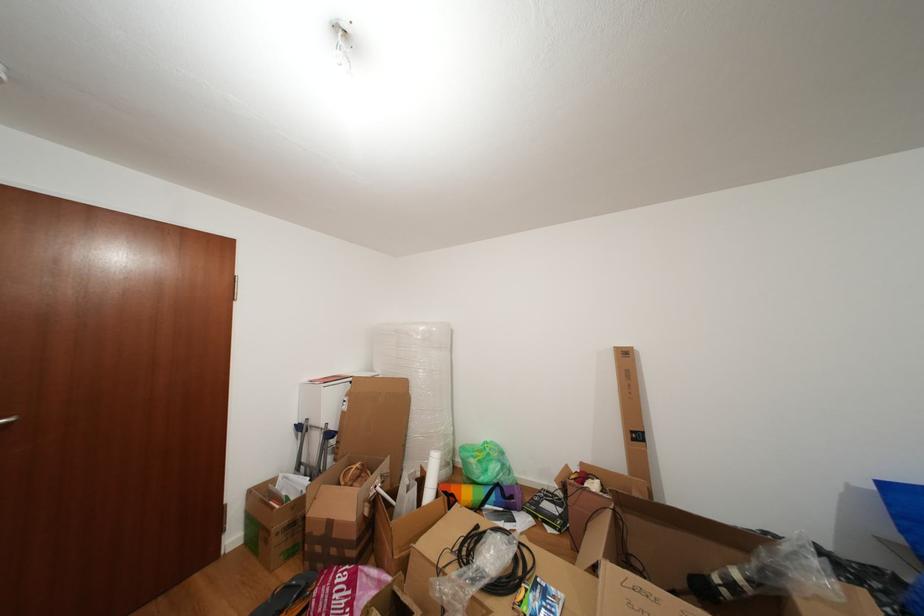
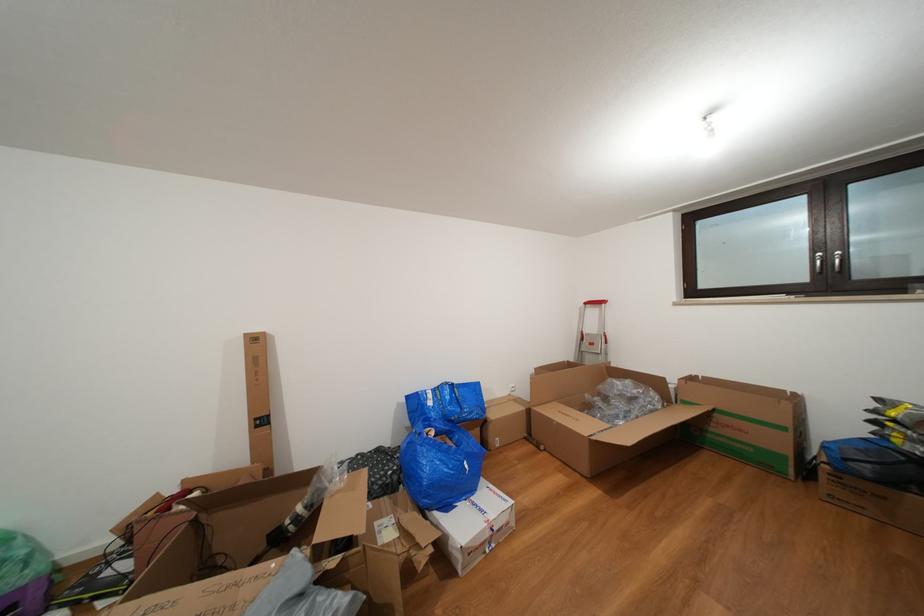
Question: The camera is either moving clockwise (left) or counter-clockwise (right) around the object. The first image is from the beginning of the video and the second image is from the end. Is the camera moving left or right when shooting the video?

Choices:
 (A) Left
 (B) Right

Answer: (A)